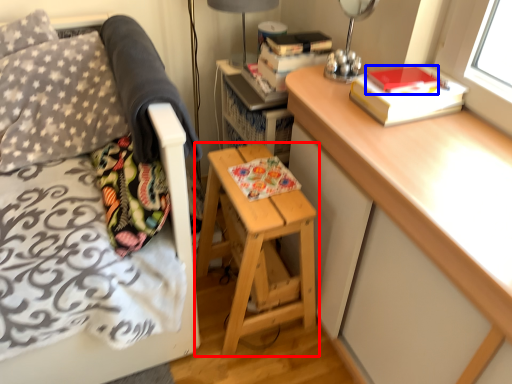
Question: Which object is closer to the camera taking this photo, stool (highlighted by a red box) or paperback book (highlighted by a blue box)?

Choices:
 (A) stool
 (B) paperback book

Answer: (B)